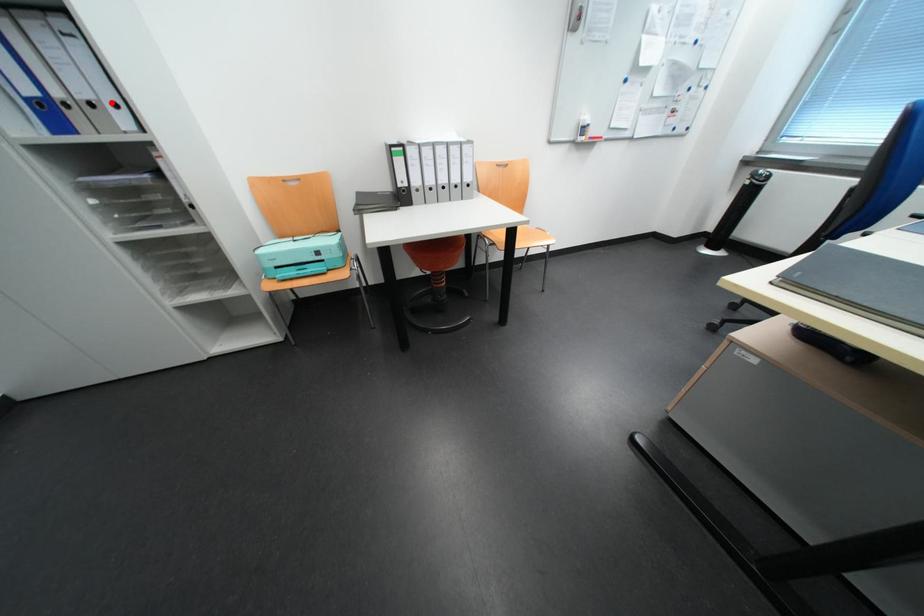
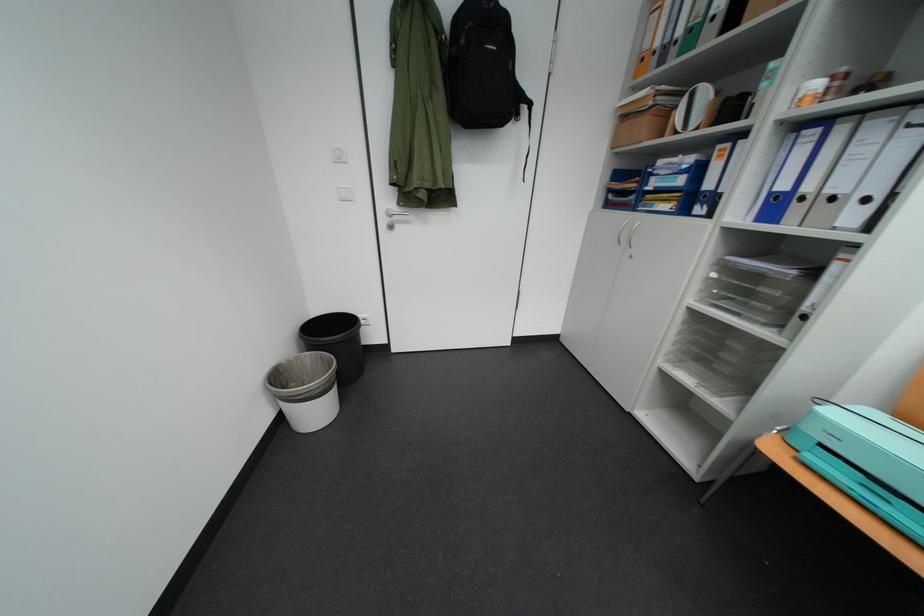
Find the pixel in the second image that matches the highlighted location in the first image.

(861, 197)